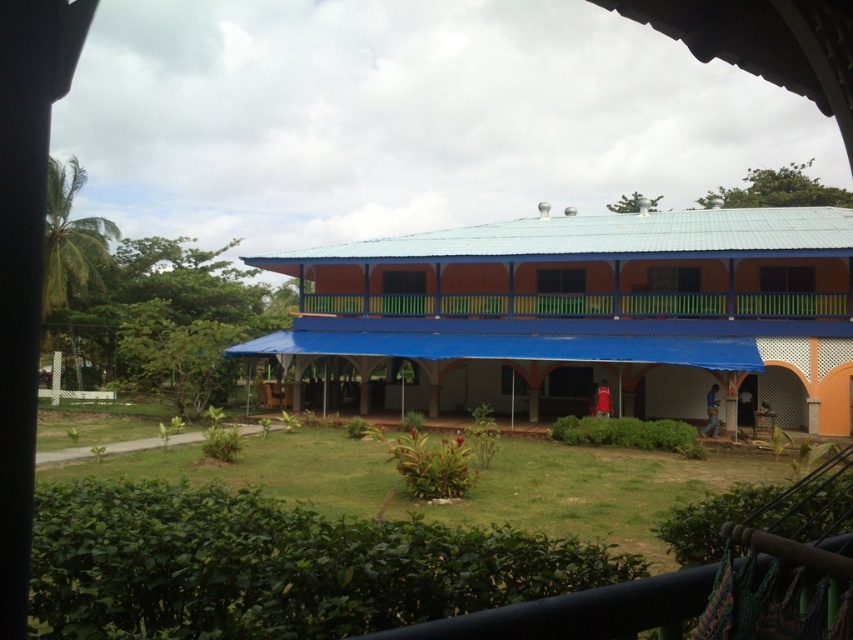
Question: Can you confirm if blue fabric canopy at center is smaller than green painted wood balcony at center?

Choices:
 (A) yes
 (B) no

Answer: (B)

Question: Can you confirm if blue fabric canopy at center is smaller than green painted wood balcony at center?

Choices:
 (A) yes
 (B) no

Answer: (B)

Question: Is the position of blue fabric canopy at center less distant than that of green painted wood balcony at center?

Choices:
 (A) yes
 (B) no

Answer: (A)

Question: Which object is closer to the camera taking this photo?

Choices:
 (A) blue fabric canopy at center
 (B) green painted wood balcony at center

Answer: (A)

Question: Among these objects, which one is nearest to the camera?

Choices:
 (A) green painted wood balcony at center
 (B) blue fabric canopy at center

Answer: (B)